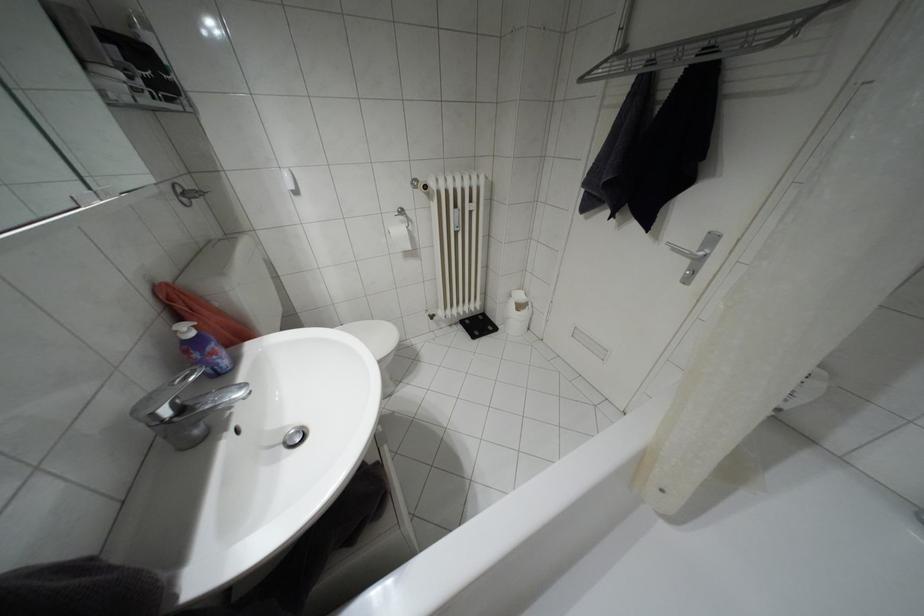
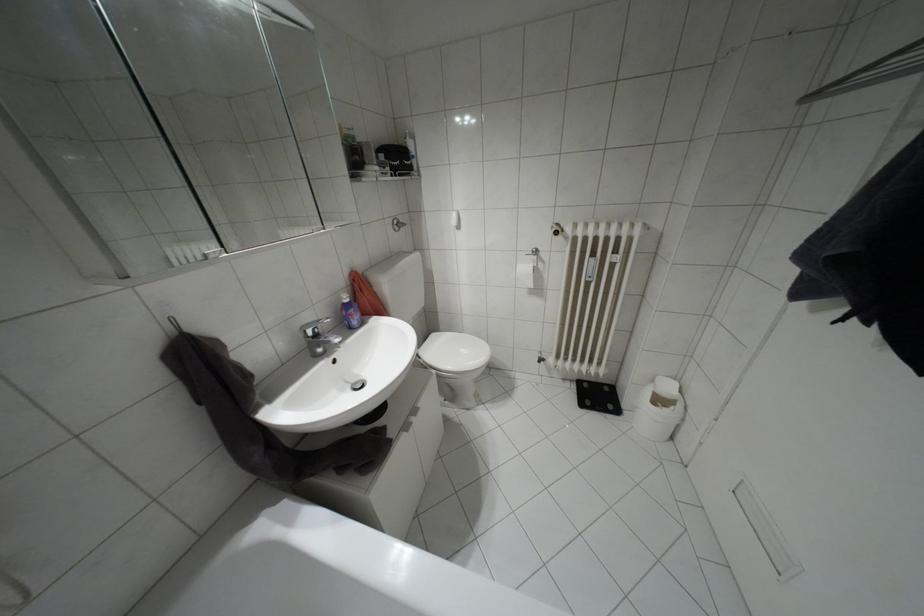
The point at (190, 333) is marked in the first image. Where is the corresponding point in the second image?

(346, 300)